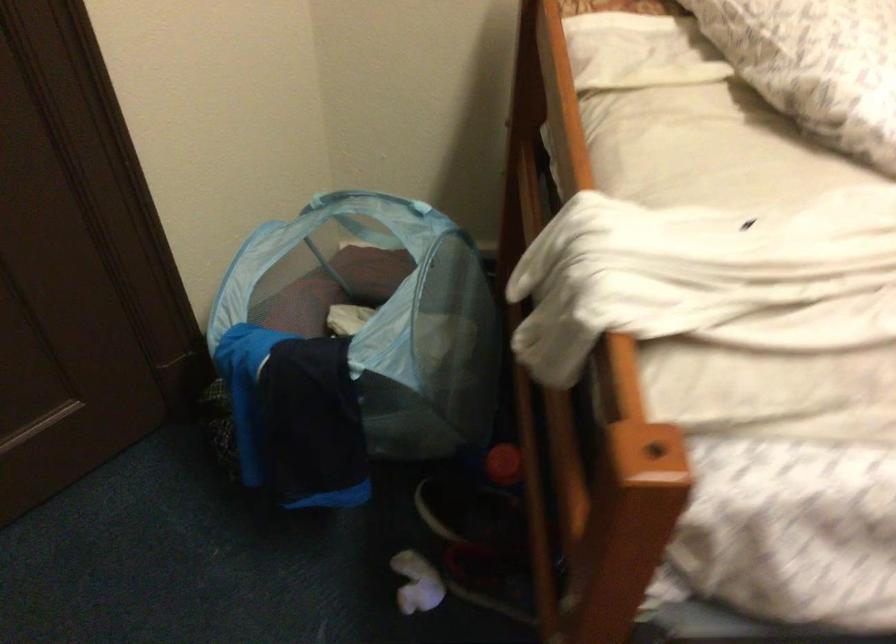
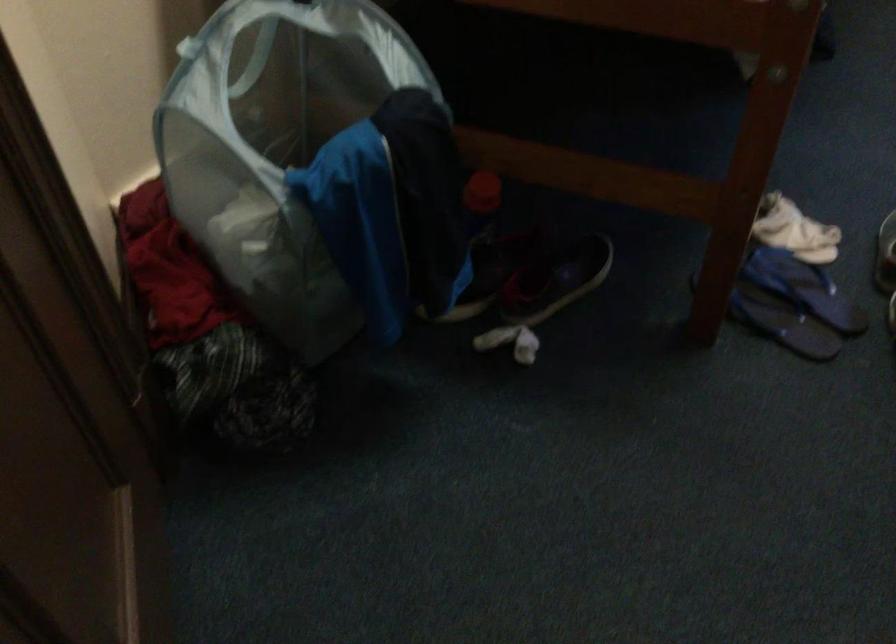
Where in the second image is the point corresponding to (487,473) from the first image?

(480, 202)